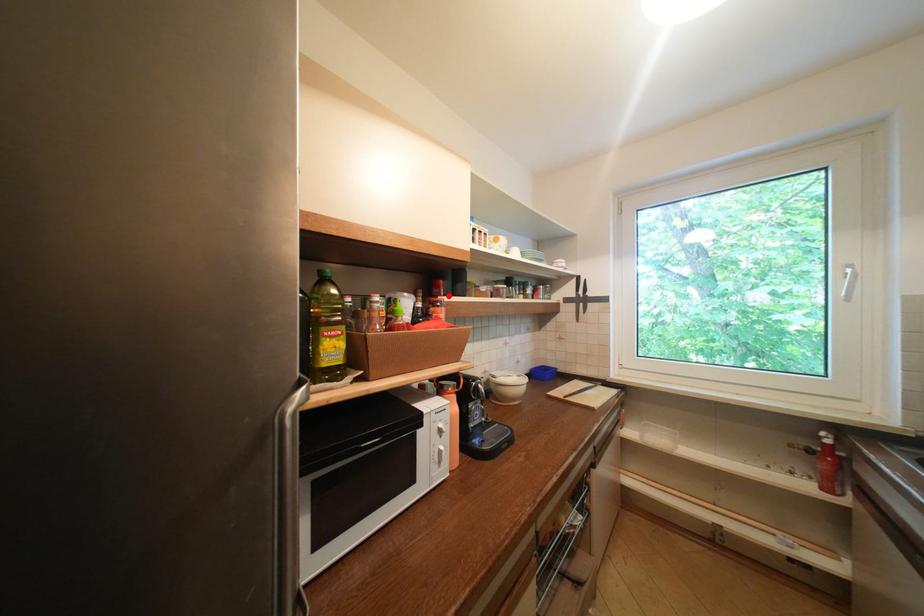
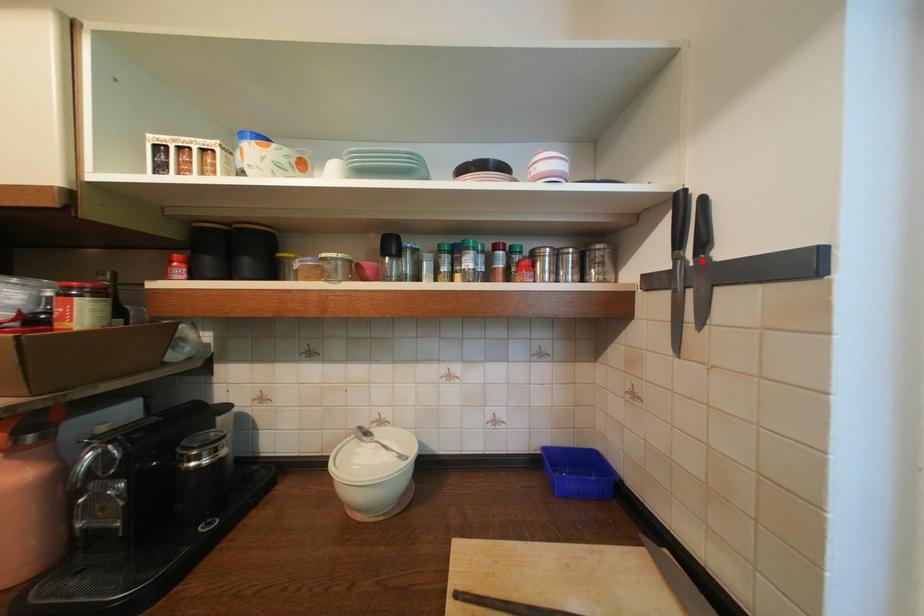
I am providing you with two images of the same scene from different viewpoints. A red point is marked on the first image and another point is marked on the second image. Are the points marked in image1 and image2 representing the same 3D position?

No